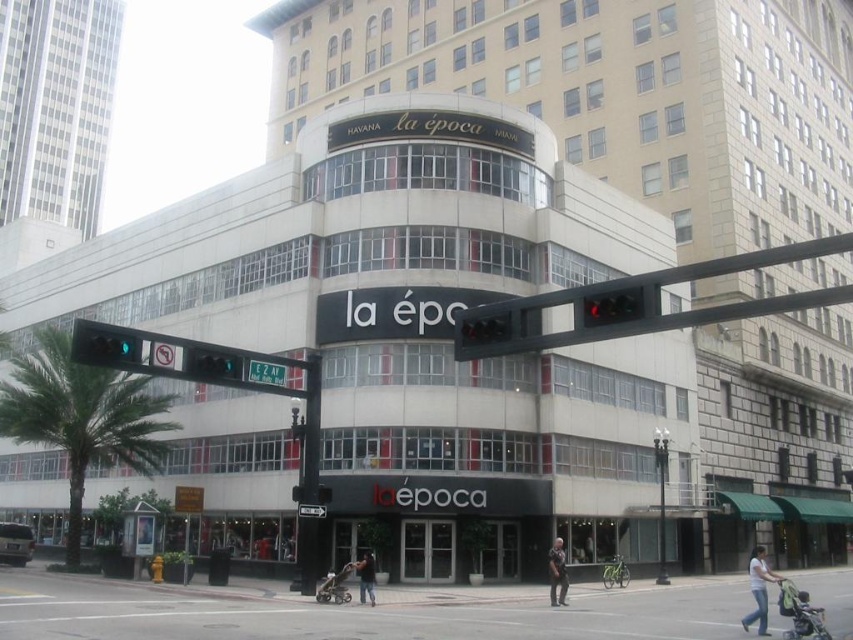
You are a pedestrian standing at the corner of the street looking at the building with the large black sign. You notice a green glass traffic light at upper center and a white cotton shirt at lower right. Which object is closer to you?

The green glass traffic light at upper center is closer to you because the white cotton shirt at lower right is behind it.

What is the spatial relationship between the green metallic street sign at upper center and the green plastic street sign at center?

The green metallic street sign at upper center is located to the left of the green plastic street sign at center.

You are a delivery person trying to navigate through the urban corner. You see a green glass traffic light at upper center and a white cotton shirt at lower right. Which object is smaller in size?

The green glass traffic light at upper center is smaller in size compared to the white cotton shirt at lower right.